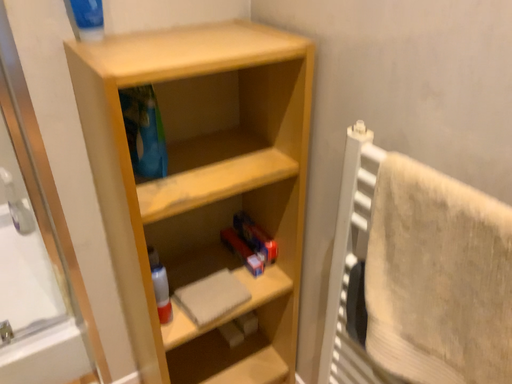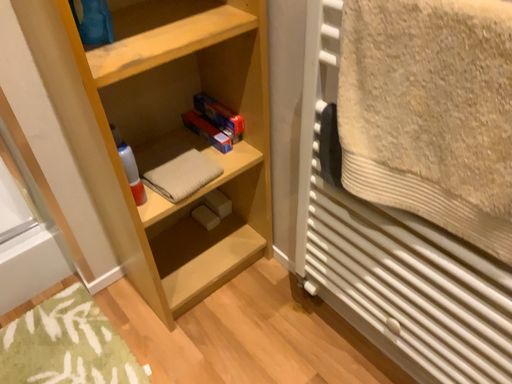
Question: How did the camera likely rotate when shooting the video?

Choices:
 (A) rotated downward
 (B) rotated upward

Answer: (A)